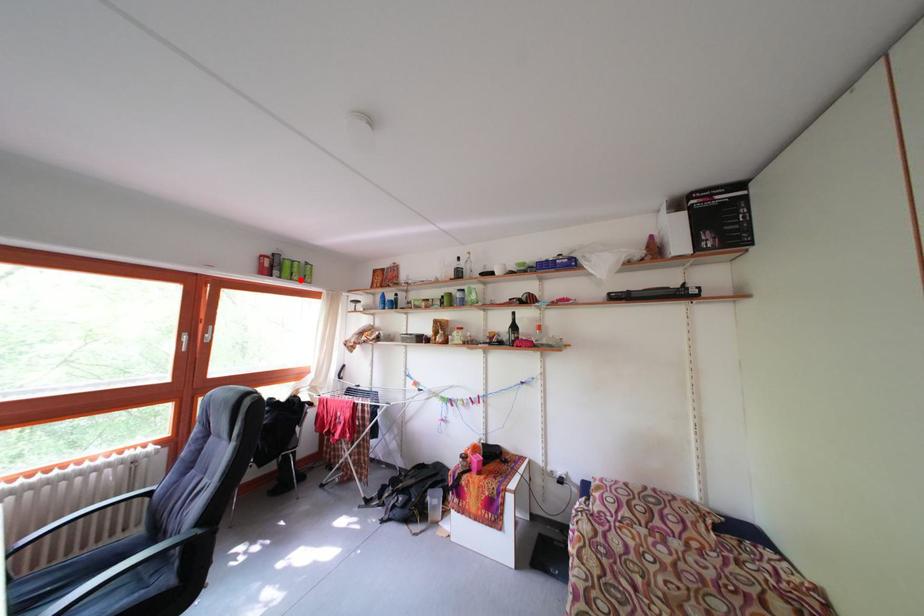
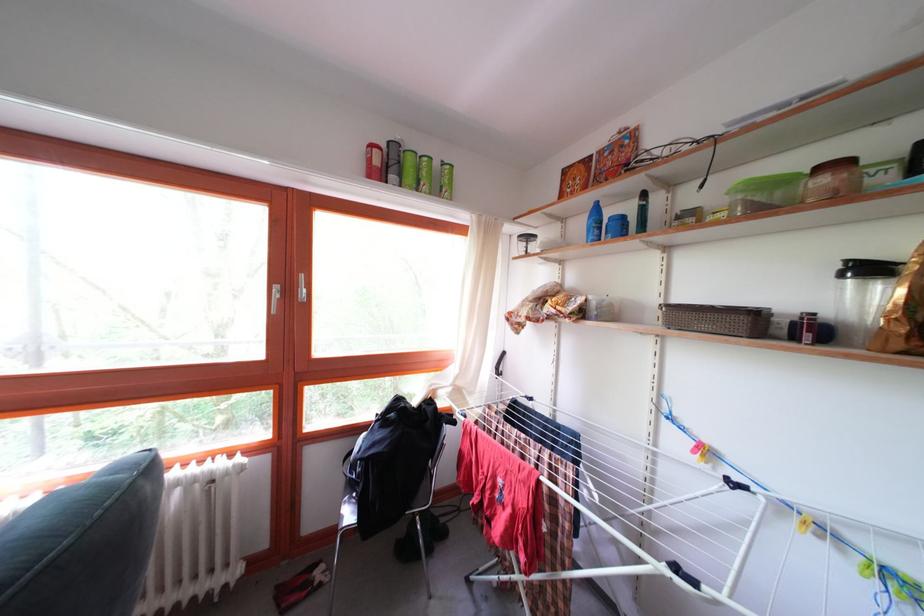
Where in the second image is the point corresponding to the highlighted location from the first image?

(428, 187)